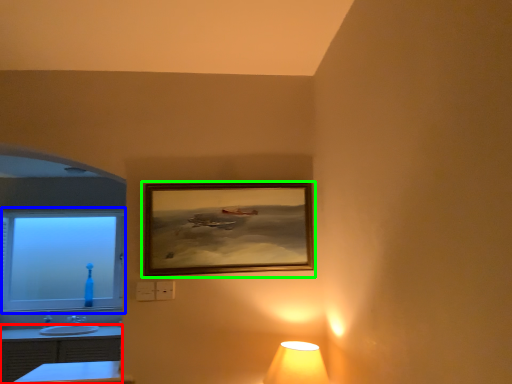
Question: Which is nearer to the dresser (highlighted by a red box)? window (highlighted by a blue box) or picture frame (highlighted by a green box).

Choices:
 (A) window
 (B) picture frame

Answer: (A)